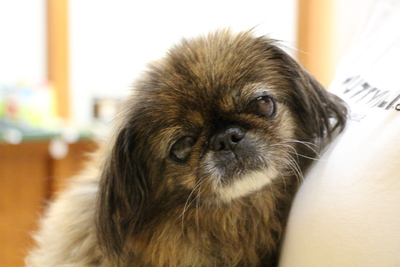
Find the location of `cushion`. cushion is located at coordinates (365, 189).